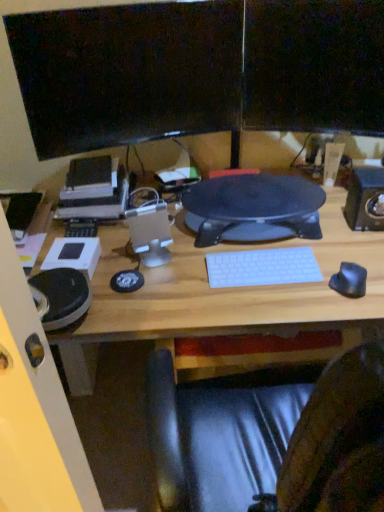
At what (x,y) coordinates should I click in order to perform the action: click on free point to the right of white plastic keyboard at center. Please return your answer as a coordinate pair (x, y). Looking at the image, I should click on (334, 272).